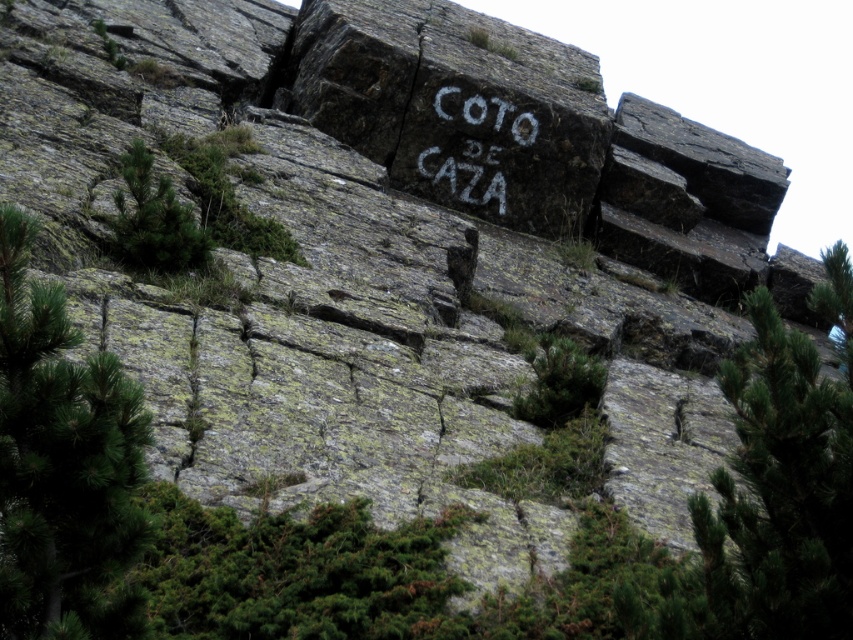
Is green leafy tree at lower left above white chalk writing at center?

Incorrect, green leafy tree at lower left is not positioned above white chalk writing at center.

Which is behind, point (59, 472) or point (485, 134)?

Positioned behind is point (485, 134).

Identify the location of green leafy tree at lower left. This screenshot has width=853, height=640. tap(62, 467).

Between green textured pine tree at center and white chalk writing at center, which one appears on the right side from the viewer's perspective?

Positioned to the right is green textured pine tree at center.

Is green textured pine tree at center to the left of white chalk writing at center from the viewer's perspective?

No, green textured pine tree at center is not to the left of white chalk writing at center.

Is point (815, 308) behind point (506, 109)?

That is False.

At what (x,y) coordinates should I click in order to perform the action: click on green textured pine tree at center. Please return your answer as a coordinate pair (x, y). The width and height of the screenshot is (853, 640). Looking at the image, I should click on (784, 480).

Who is positioned more to the left, green leafy tree at lower left or green leafy tree at left?

Result: green leafy tree at left

Which is behind, point (26, 304) or point (123, 173)?

The point (123, 173) is behind.

Is point (70, 406) behind point (126, 256)?

No.

Where is `green leafy tree at lower left`? The height and width of the screenshot is (640, 853). green leafy tree at lower left is located at coordinates (62, 467).